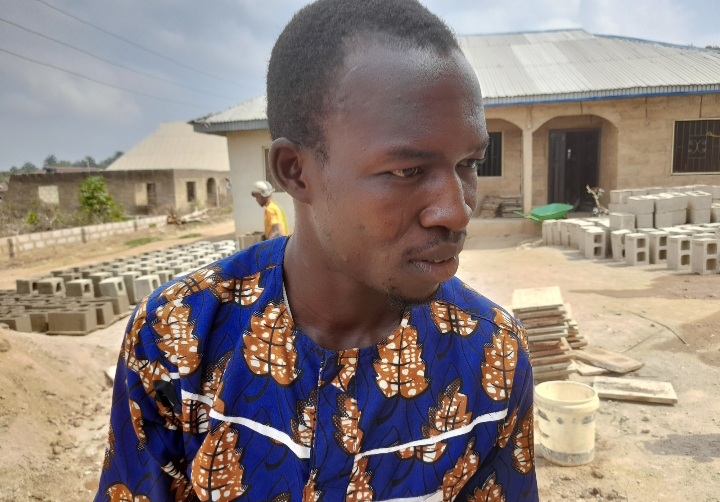
The width and height of the screenshot is (720, 502). I want to click on window, so [690, 140], [487, 157].